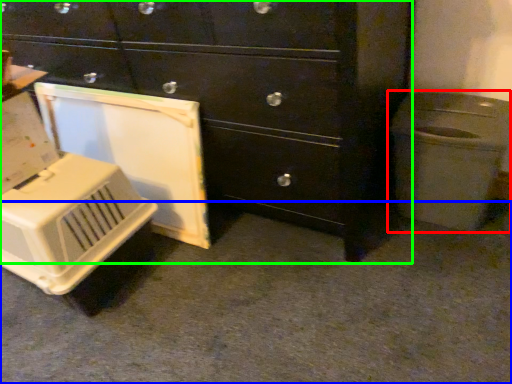
Question: Which is nearer to the waste container (highlighted by a red box)? concrete (highlighted by a blue box) or chest of drawers (highlighted by a green box).

Choices:
 (A) concrete
 (B) chest of drawers

Answer: (B)